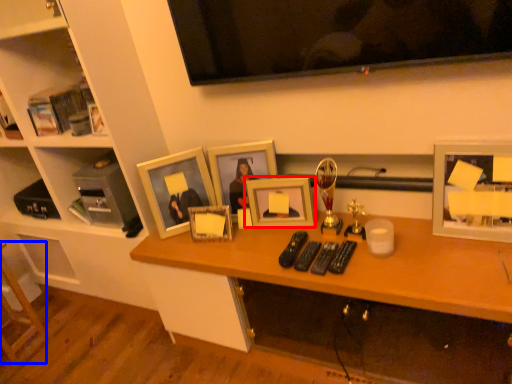
Question: Which of the following is the farthest to the observer, picture frame (highlighted by a red box) or furniture (highlighted by a blue box)?

Choices:
 (A) picture frame
 (B) furniture

Answer: (B)